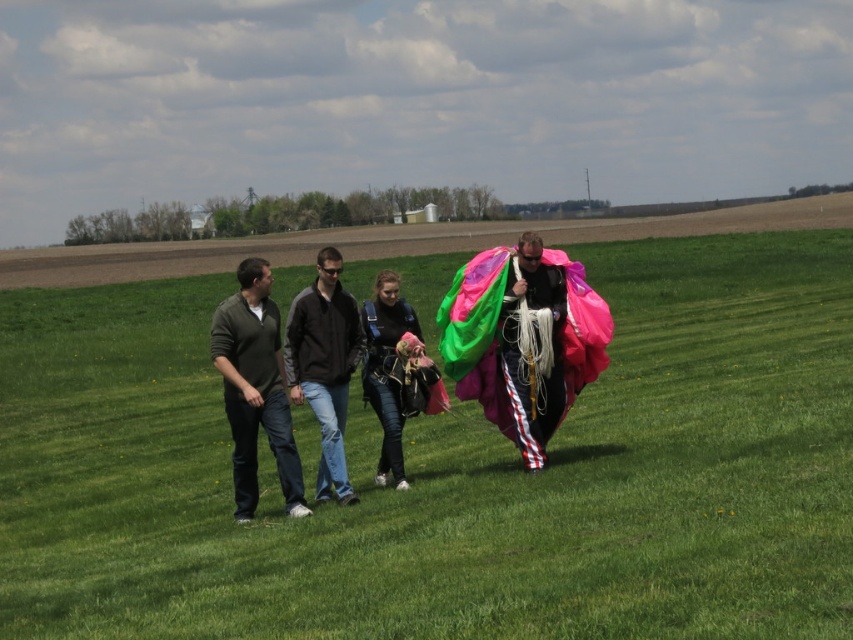
You are planning to set up a picnic blanket on the green grass field at center. The picnic blanket is 2 meters wide. You also have a multicolored fabric parachute at center that you want to display nearby. What is the minimum distance you need to keep between the picnic blanket and the parachute to ensure they don not overlap?

The green grass field at center and multicolored fabric parachute at center are 13.02 meters apart from each other. To ensure they do not overlap, the minimum distance between the picnic blanket and the parachute should be at least 13.02 meters minus the width of the picnic blanket. Since the picnic blanket is 2 meters wide, the minimum distance required would be 13.02 meters minus 2 meters, which equals 11.02 meters.

In the scene shown: You are standing at the origin point of the image coordinate system. The parachute is located at point (523, 339). If you want to walk directly towards the parachute, which direction should you head?

The point (523, 339) indicates the multicolored fabric parachute at center, so you should head towards the center of the image to reach it.

You are a photographer standing on the grassy field. You want to take a photo that includes both the green matte shirt at left and the denim jacket at center. Which one should you focus on first to ensure both are in the frame?

The green matte shirt at left is in front of the denim jacket at center, so you should focus on the denim jacket at center first to ensure both are in the frame.